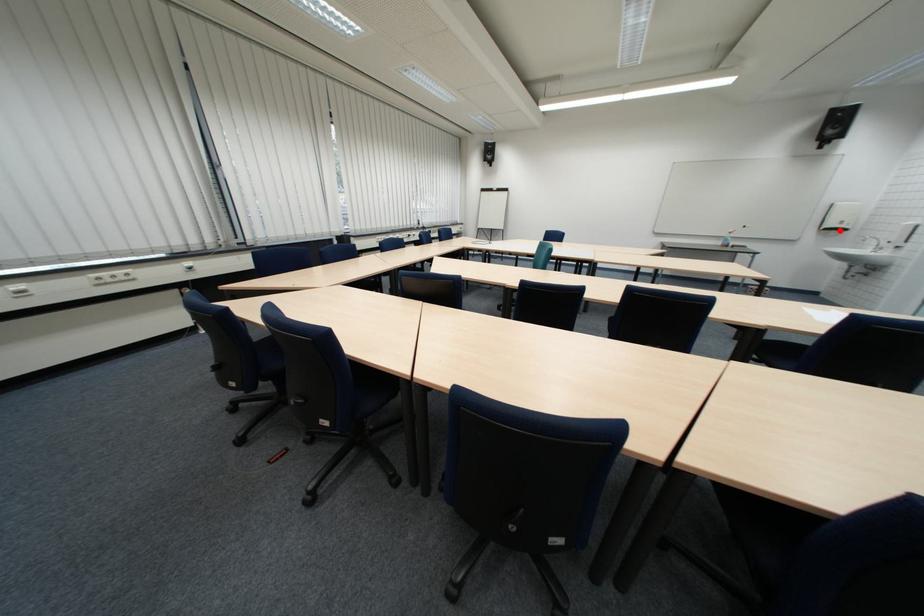
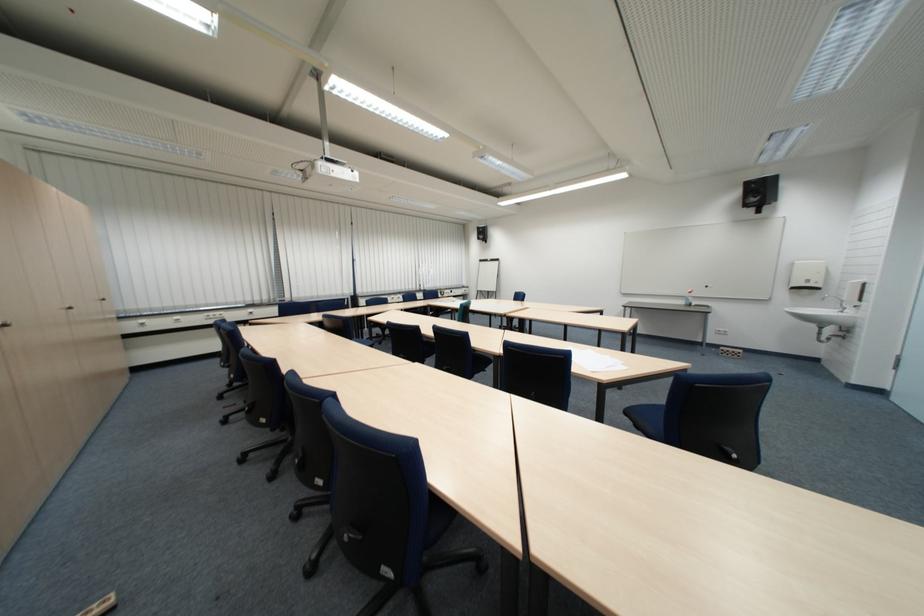
Locate, in the second image, the point that corresponds to the highlighted location in the first image.

(807, 290)